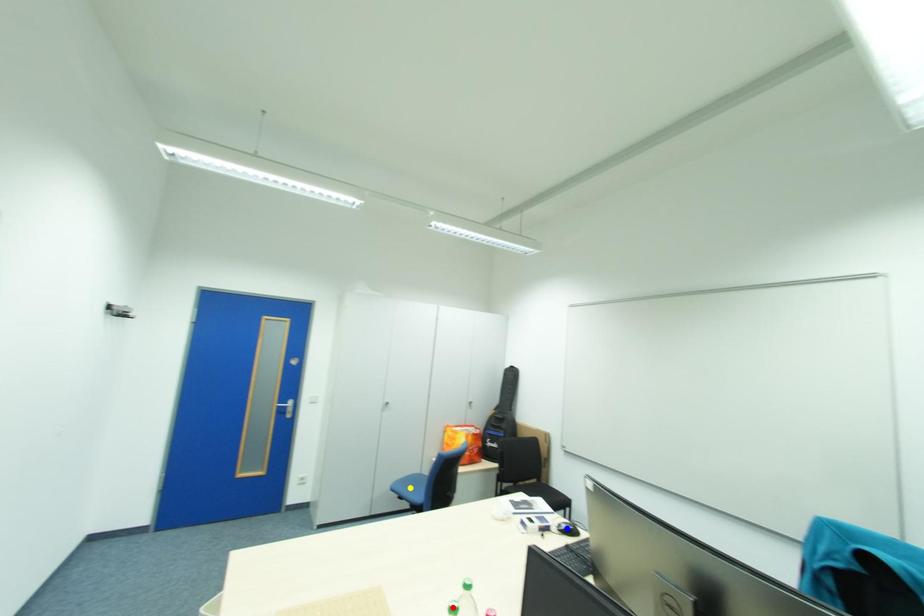
Order these from nearest to farthest:
- red point
- blue point
- yellow point

yellow point, blue point, red point